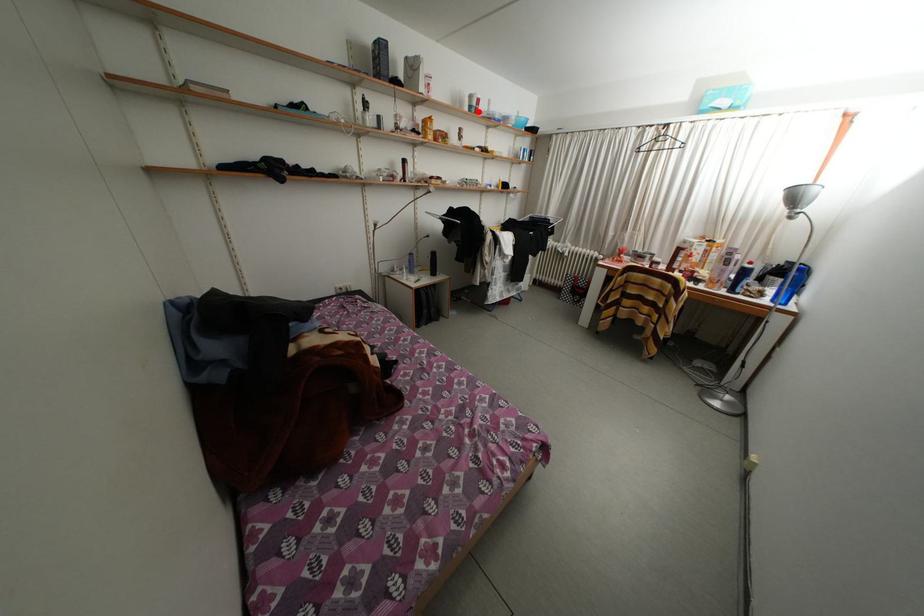
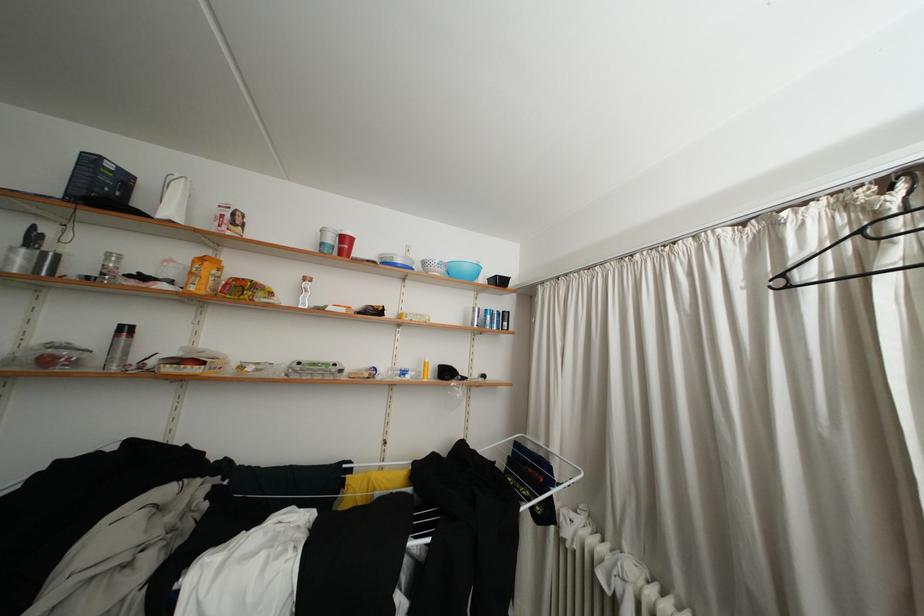
In the second image, find the point that corresponds to the highlighted location in the first image.

(330, 249)